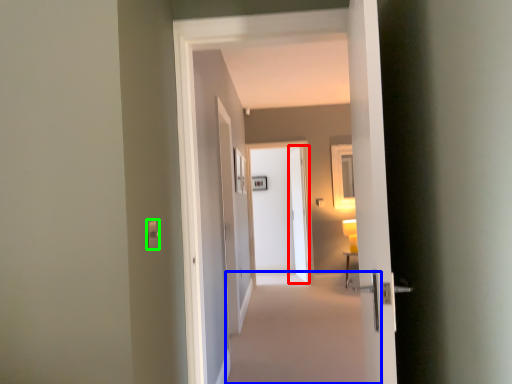
Question: Estimate the real-world distances between objects in this image. Which object is farther from screen door (highlighted by a red box), plain (highlighted by a blue box) or light switch (highlighted by a green box)?

Choices:
 (A) plain
 (B) light switch

Answer: (B)